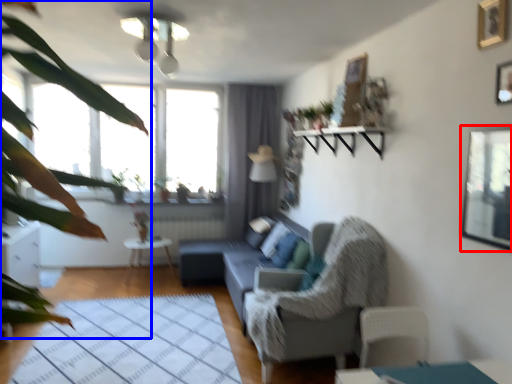
Question: Which object is further to the camera taking this photo, window screen (highlighted by a red box) or vegetation (highlighted by a blue box)?

Choices:
 (A) window screen
 (B) vegetation

Answer: (A)